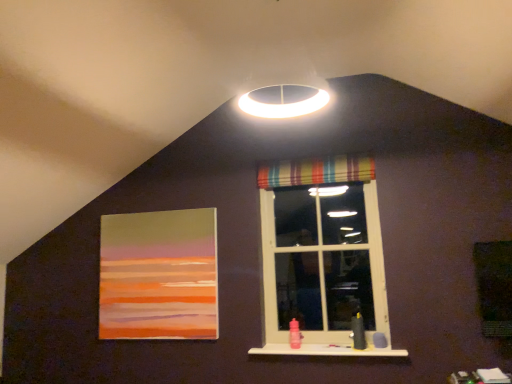
Question: Is striped fabric window at center bigger than striped fabric curtain at upper center?

Choices:
 (A) yes
 (B) no

Answer: (A)

Question: Is striped fabric window at center completely or partially outside of striped fabric curtain at upper center?

Choices:
 (A) no
 (B) yes

Answer: (B)

Question: From a real-world perspective, does striped fabric window at center sit lower than striped fabric curtain at upper center?

Choices:
 (A) no
 (B) yes

Answer: (B)

Question: Does striped fabric window at center have a lesser width compared to striped fabric curtain at upper center?

Choices:
 (A) yes
 (B) no

Answer: (B)

Question: Is striped fabric curtain at upper center located within striped fabric window at center?

Choices:
 (A) yes
 (B) no

Answer: (B)

Question: Does striped fabric window at center have a greater width compared to striped fabric curtain at upper center?

Choices:
 (A) no
 (B) yes

Answer: (B)

Question: Is there a large distance between striped fabric curtain at upper center and matte acrylic painting at left?

Choices:
 (A) no
 (B) yes

Answer: (B)

Question: Considering the relative sizes of striped fabric curtain at upper center and matte acrylic painting at left in the image provided, is striped fabric curtain at upper center thinner than matte acrylic painting at left?

Choices:
 (A) no
 (B) yes

Answer: (A)

Question: Does striped fabric curtain at upper center appear on the left side of matte acrylic painting at left?

Choices:
 (A) no
 (B) yes

Answer: (A)

Question: Is striped fabric curtain at upper center facing towards matte acrylic painting at left?

Choices:
 (A) yes
 (B) no

Answer: (B)

Question: Does striped fabric curtain at upper center have a lesser height compared to matte acrylic painting at left?

Choices:
 (A) no
 (B) yes

Answer: (B)

Question: From a real-world perspective, is striped fabric curtain at upper center below matte acrylic painting at left?

Choices:
 (A) yes
 (B) no

Answer: (B)

Question: Is the position of striped fabric window at center more distant than that of matte acrylic painting at left?

Choices:
 (A) no
 (B) yes

Answer: (A)